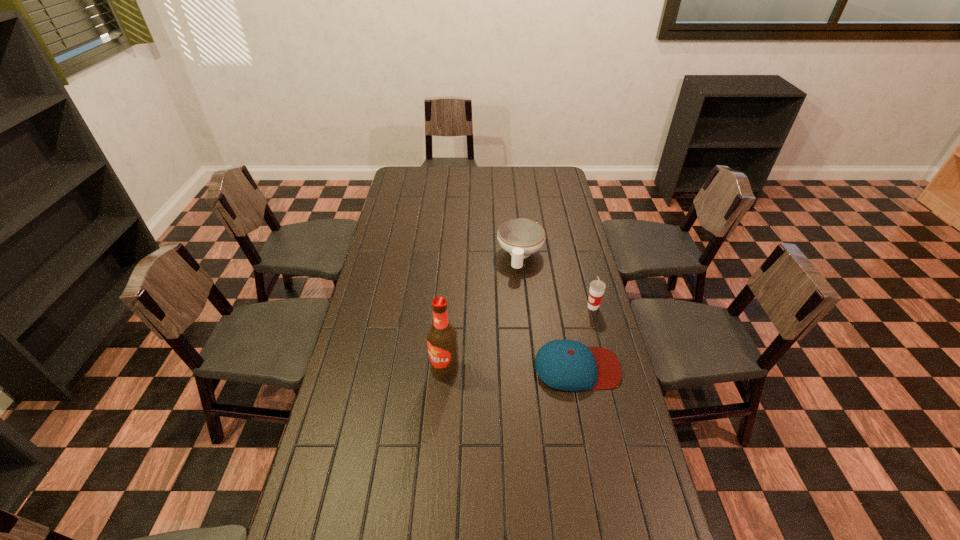
Identify the location of free point between the third tallest object and the leftmost object. This screenshot has width=960, height=540. (483, 313).

At what (x,y) coordinates should I click in order to perform the action: click on object that can be found as the closest to the third shortest object. Please return your answer as a coordinate pair (x, y). The image size is (960, 540). Looking at the image, I should click on (568, 365).

Choose which object is the second nearest neighbor to the third tallest object. Please provide its 2D coordinates. Your answer should be formatted as a tuple, i.e. [(x, y)], where the tuple contains the x and y coordinates of a point satisfying the conditions above.

[(568, 365)]

Locate an element on the screen. Image resolution: width=960 pixels, height=540 pixels. free spot that satisfies the following two spatial constraints: 1. on the front side of the chinaware; 2. with the bill of the baseball cap facing forward is located at coordinates (533, 368).